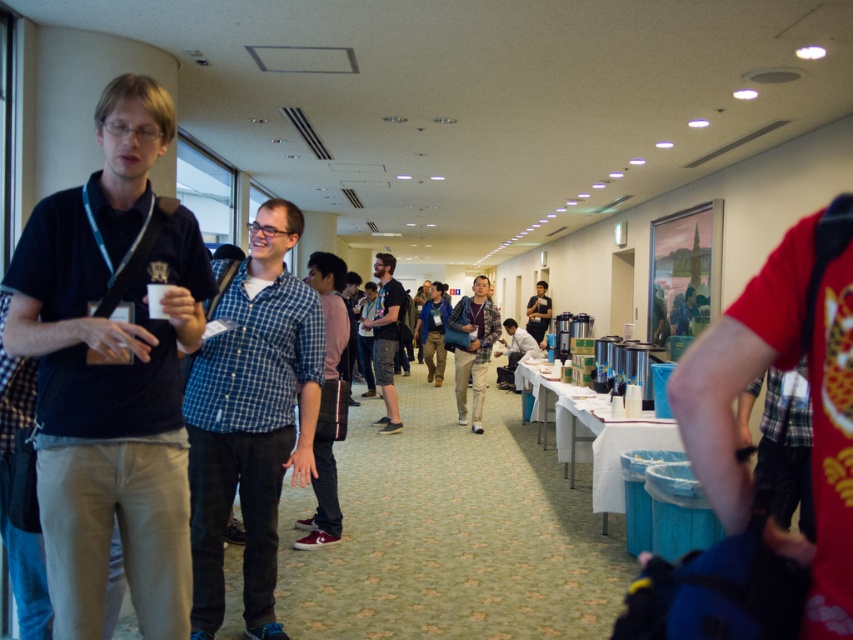
Question: Can you confirm if blue checkered shirt at center is positioned below dark blue shirt at center?

Choices:
 (A) no
 (B) yes

Answer: (B)

Question: Does light brown fabric pants at center appear over blue denim jacket at center?

Choices:
 (A) yes
 (B) no

Answer: (B)

Question: Which object appears farthest from the camera in this image?

Choices:
 (A) dark blue shirt at left
 (B) dark blue shirt at center
 (C) light brown fabric pants at center
 (D) blue checkered shirt at center

Answer: (C)

Question: Among these objects, which one is nearest to the camera?

Choices:
 (A) light brown fabric pants at center
 (B) dark blue shirt at center
 (C) blue denim jacket at center
 (D) blue checkered shirt at center

Answer: (D)

Question: Which point appears farthest from the camera in this image?

Choices:
 (A) (492, 333)
 (B) (376, 268)

Answer: (A)

Question: Can you confirm if dark blue shirt at left is positioned below dark blue shirt at center?

Choices:
 (A) no
 (B) yes

Answer: (A)